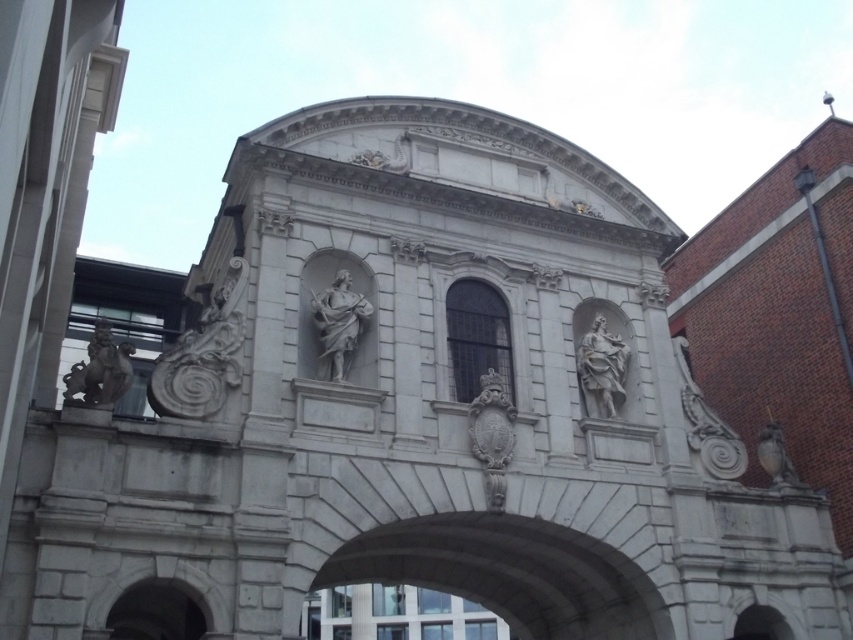
You are an architect examining the classical structure. You notice two points marked in the image. The first point is at coordinate point (x=354, y=339) and the second is at point (x=583, y=365). Based on the structure described, which of these points is closer to the viewer?

Point (x=354, y=339) is closer to the viewer as it is in front of point (x=583, y=365).

You are an architect designing a new building inspired by classical architecture. You need to ensure that the clear glass window at center and the matte white statue at right will fit through a standard doorway that is 0.5 meters thick. Based on their thickness, will both items fit through the doorway?

The clear glass window at center is thinner than the matte white statue at right. Since the doorway is 0.5 meters thick, we need to know the exact thickness of both items. However, the description only states their relative thickness. Without specific measurements, we cannot confirm if both will fit. Please provide the exact thickness dimensions for further analysis.

You are an art conservator tasked with cleaning the white marble statue at right and the clear glass window at center. Which object should you clean first if you want to start with the one that is farther from the entrance of the structure?

The white marble statue at right is behind the clear glass window at center, so it is farther from the entrance. Therefore, you should clean the white marble statue at right first.